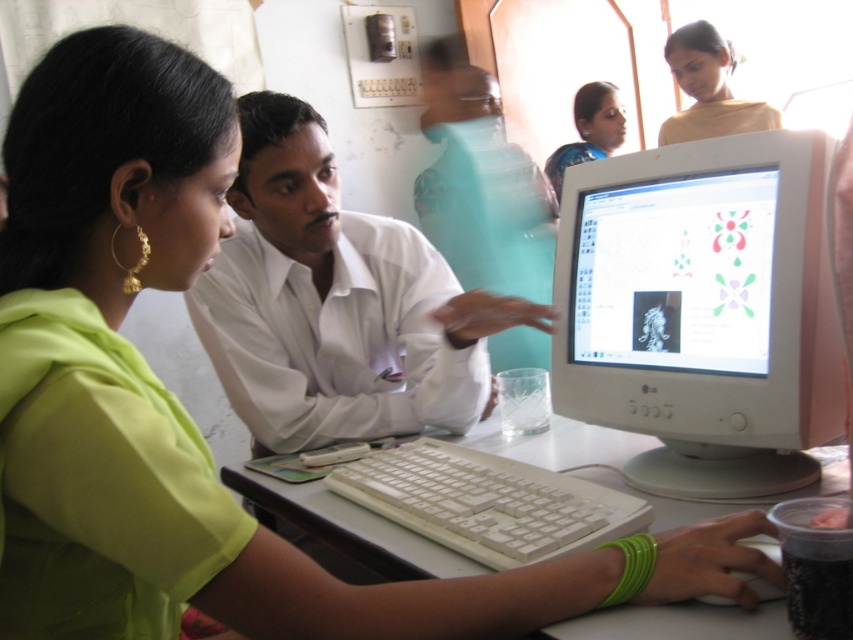
Is matte yellow blouse at upper right further to the viewer compared to matte green saree at upper center?

No, matte yellow blouse at upper right is in front of matte green saree at upper center.

Does point (726, 106) lie behind point (582, 93)?

No, it is not.

Consider the image. Who is more distant from viewer, (682,138) or (611,152)?

The point (611,152) is behind.

At what (x,y) coordinates should I click in order to perform the action: click on matte yellow blouse at upper right. Please return your answer as a coordinate pair (x, y). This screenshot has height=640, width=853. Looking at the image, I should click on (708, 88).

Which is more to the left, white plastic monitor at center or white smooth shirt at center?

From the viewer's perspective, white smooth shirt at center appears more on the left side.

Does white plastic monitor at center have a greater height compared to white smooth shirt at center?

In fact, white plastic monitor at center may be shorter than white smooth shirt at center.

Does point (598, 230) come farther from viewer compared to point (381, 262)?

No.

Identify the location of white plastic monitor at center. This screenshot has width=853, height=640. (701, 310).

Can you confirm if white plastic table at center is thinner than matte yellow blouse at upper right?

In fact, white plastic table at center might be wider than matte yellow blouse at upper right.

Which of these two, white plastic table at center or matte yellow blouse at upper right, stands shorter?

white plastic table at center is shorter.

At what (x,y) coordinates should I click in order to perform the action: click on white plastic table at center. Please return your answer as a coordinate pair (x, y). This screenshot has height=640, width=853. Looking at the image, I should click on (349, 528).